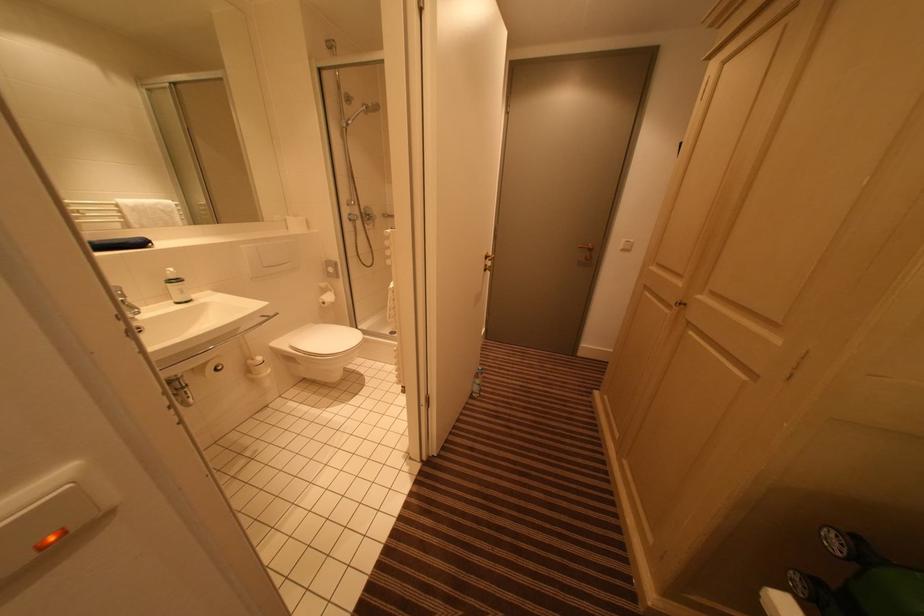
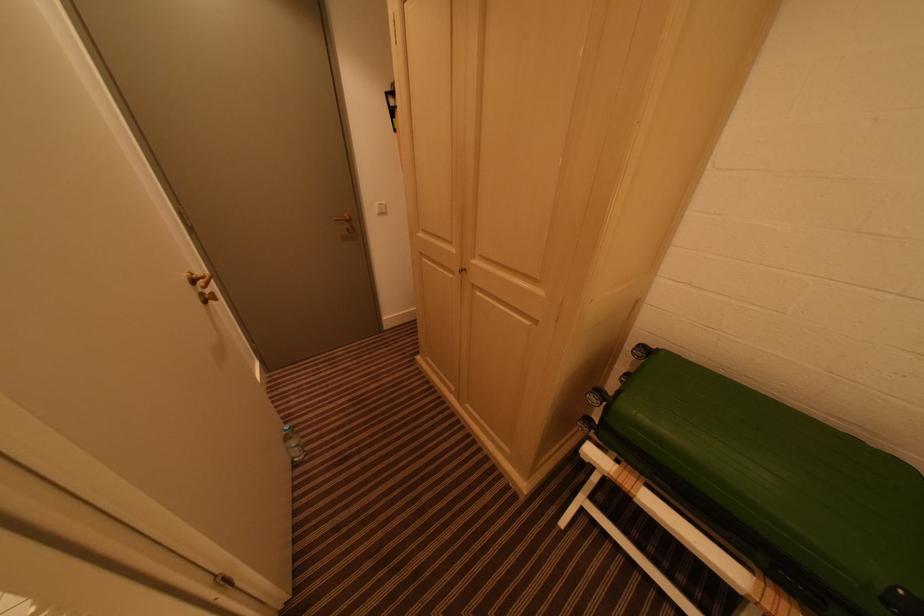
Find the pixel in the second image that matches (492,268) in the first image.

(208, 296)